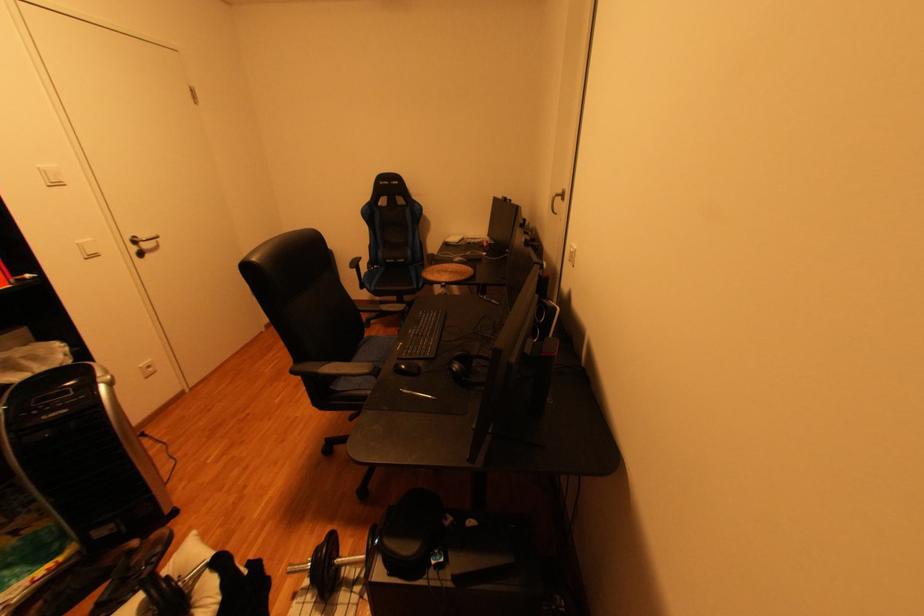
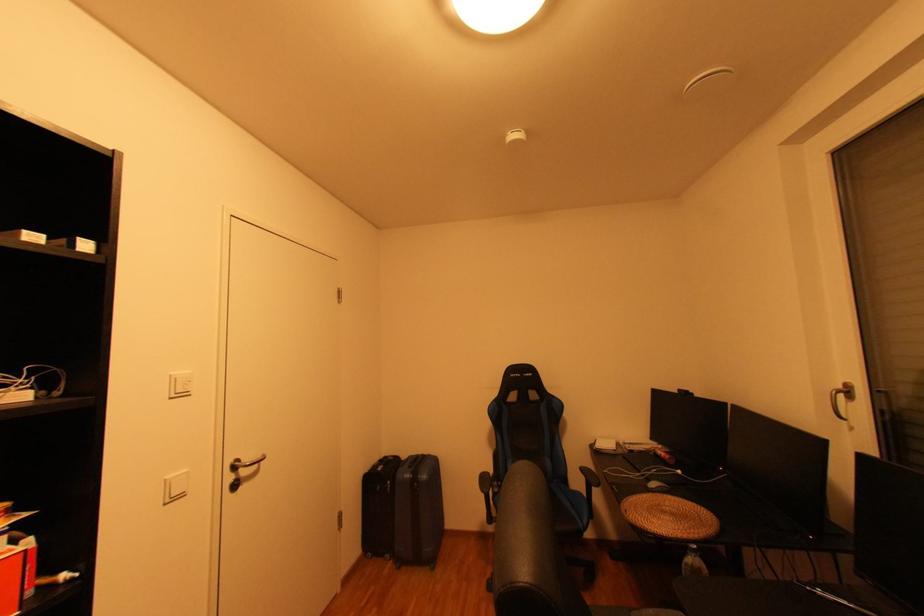
The point at [456,241] is marked in the first image. Where is the corresponding point in the second image?

(606, 448)